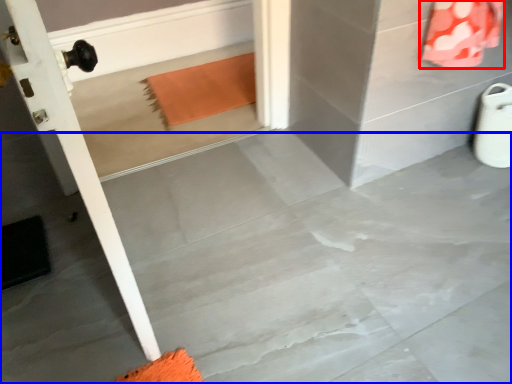
Question: Which point is further to the camera, material (highlighted by a red box) or concrete (highlighted by a blue box)?

Choices:
 (A) material
 (B) concrete

Answer: (A)